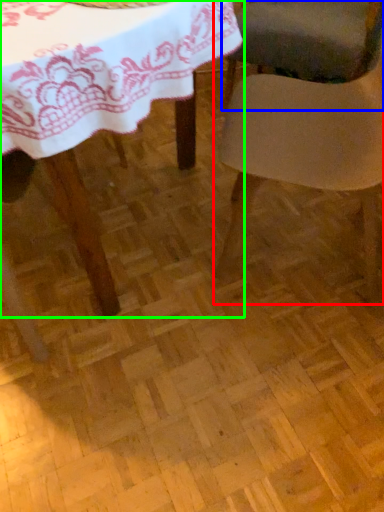
Question: Based on their relative distances, which object is farther from chair (highlighted by a red box)? Choose from chair (highlighted by a blue box) and table (highlighted by a green box).

Choices:
 (A) chair
 (B) table

Answer: (A)